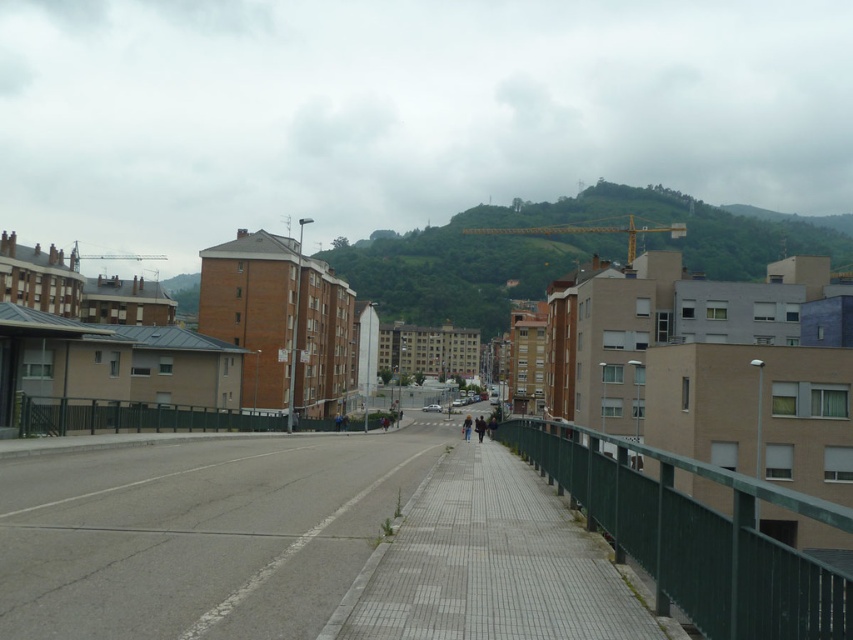
You are a delivery person carrying a large box that is 1.2 meters wide. You are standing on the sidewalk bordered by the dark green metal railing and need to walk past the dark blue jeans at center and the dark blue jacket at center. Can your box fit through the space between these two items without touching them?

The dark blue jeans at center might be wider than dark blue jacket at center, but since the box is 1.2 meters wide, it is uncertain if there is enough space. You should check the actual width between them before proceeding.

You are a delivery robot positioned at the start of the gray concrete pavement at center. Your destination is the green grassy hill at center. According to the image, which direction should you move to reach your destination?

The gray concrete pavement at center is in front of the green grassy hill at center, so you should move forward along the gray concrete pavement at center to reach the green grassy hill at center.

You are a delivery person standing on the gray concrete sidewalk at center and need to reach the dark blue jacket at center. Can you step directly onto the jacket from your current position?

The gray concrete sidewalk at center is located above the dark blue jacket at center, so you can step directly onto the jacket from your current position on the sidewalk.